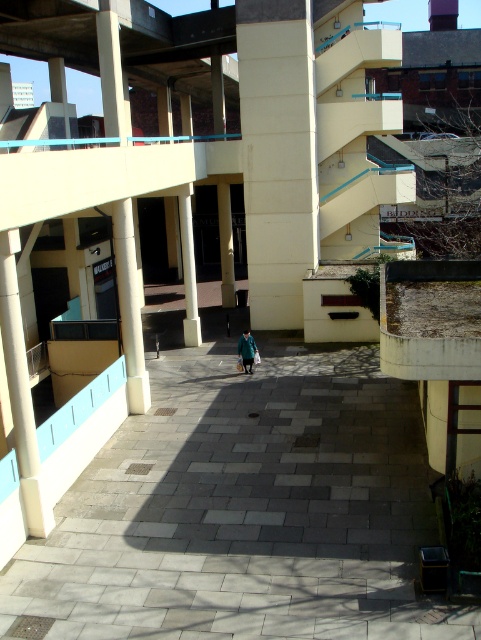
Question: Which point is farther from the camera taking this photo?

Choices:
 (A) (20, 435)
 (B) (244, 348)
 (C) (279, 241)
 (D) (189, 296)

Answer: (C)

Question: Which object appears closest to the camera in this image?

Choices:
 (A) gray concrete pavement at center
 (B) white concrete pillar at left
 (C) matte yellow pillar at center

Answer: (A)

Question: Can you confirm if white concrete pillar at left is thinner than matte yellow pillar at center?

Choices:
 (A) yes
 (B) no

Answer: (B)

Question: Is the position of white concrete pillar at left more distant than that of green fabric coat at center?

Choices:
 (A) yes
 (B) no

Answer: (B)

Question: In this image, where is matte yellow pillar at center located relative to green fabric coat at center?

Choices:
 (A) below
 (B) above

Answer: (B)

Question: Which object is farther from the camera taking this photo?

Choices:
 (A) white concrete pillar at center
 (B) matte yellow pillar at center
 (C) gray concrete pavement at center
 (D) green fabric coat at center

Answer: (B)